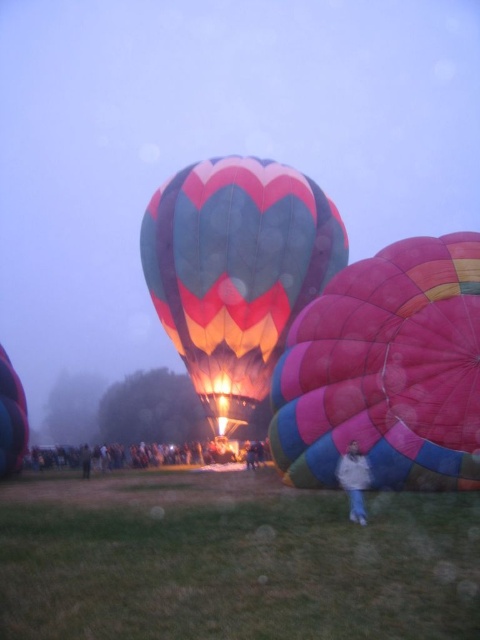
Does multicolored fabric balloon at center have a smaller size compared to multicolored fabric hot air balloon at center?

Yes, multicolored fabric balloon at center is smaller than multicolored fabric hot air balloon at center.

Consider the image. Can you confirm if multicolored fabric balloon at center is bigger than multicolored fabric hot air balloon at center?

Incorrect, multicolored fabric balloon at center is not larger than multicolored fabric hot air balloon at center.

This screenshot has width=480, height=640. Identify the location of multicolored fabric balloon at center. (386, 371).

Is multicolored fabric balloon at center below white cotton jacket at lower center?

Incorrect, multicolored fabric balloon at center is not positioned below white cotton jacket at lower center.

Between point (409, 340) and point (360, 497), which one is positioned in front?

Point (360, 497) is more forward.

Locate an element on the screen. The image size is (480, 640). multicolored fabric balloon at center is located at coordinates (386, 371).

Which is more to the left, green grass at lower center or multicolored fabric hot air balloon at center?

Positioned to the left is green grass at lower center.

Does green grass at lower center have a lesser width compared to multicolored fabric hot air balloon at center?

No, green grass at lower center is not thinner than multicolored fabric hot air balloon at center.

Is point (415, 560) positioned in front of point (222, 172)?

That is True.

Where is `green grass at lower center`? green grass at lower center is located at coordinates (232, 561).